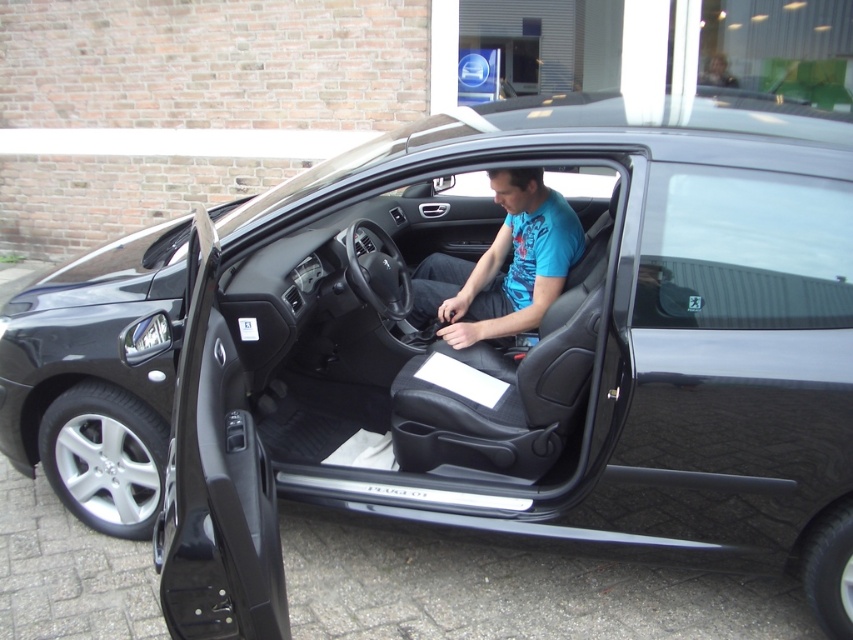
Question: Does black matte door at center appear on the right side of blue matte shirt at center?

Choices:
 (A) yes
 (B) no

Answer: (A)

Question: Does black matte door at center have a larger size compared to blue matte shirt at center?

Choices:
 (A) no
 (B) yes

Answer: (B)

Question: Which object is closer to the camera taking this photo?

Choices:
 (A) black matte door at center
 (B) blue matte shirt at center

Answer: (A)

Question: Can you confirm if black matte door at center is wider than blue matte shirt at center?

Choices:
 (A) no
 (B) yes

Answer: (B)

Question: Which point is closer to the camera?

Choices:
 (A) black matte door at center
 (B) blue matte shirt at center

Answer: (A)